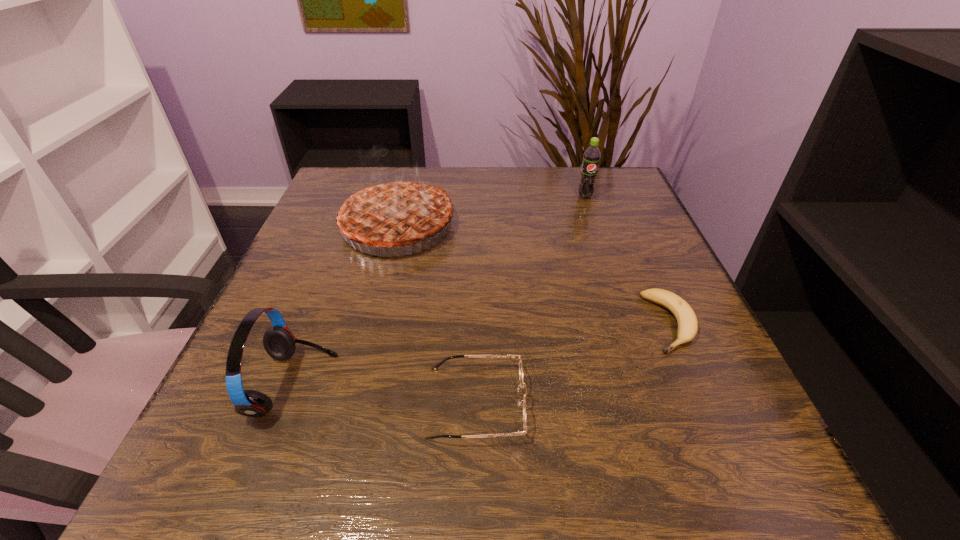
Identify the location of vacant space located 0.240m on the left of the shortest object. (512, 323).

Locate an element on the screen. The height and width of the screenshot is (540, 960). pie that is positioned at the far edge is located at coordinates (390, 212).

What are the coordinates of `soda at the far edge` in the screenshot? It's located at (591, 158).

You are a GUI agent. You are given a task and a screenshot of the screen. Output one action in this format:
    pyautogui.click(x=<x>, y=<y>)
    Task: Click on the object present at the near edge
    
    Given the screenshot: What is the action you would take?
    pyautogui.click(x=437, y=366)

Where is `pie that is at the left edge`? pie that is at the left edge is located at coordinates (390, 212).

This screenshot has height=540, width=960. In order to click on headset at the left edge in this screenshot , I will do `click(280, 344)`.

Where is `soda present at the right edge`? soda present at the right edge is located at coordinates (591, 158).

This screenshot has height=540, width=960. Identify the location of banana positioned at the right edge. (687, 321).

Find the location of a particular element. The image size is (960, 540). object located in the far left corner section of the desktop is located at coordinates (390, 212).

Find the location of a particular element. object that is at the far right corner is located at coordinates (591, 158).